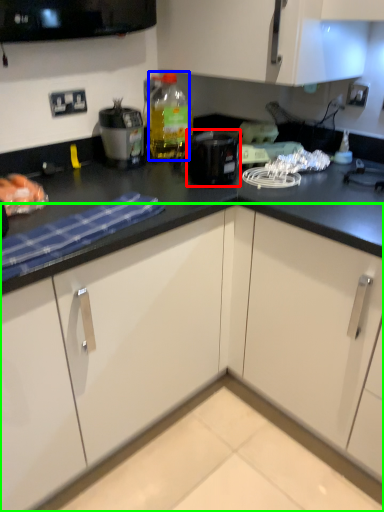
Question: Estimate the real-world distances between objects in this image. Which object is closer to kitchen appliance (highlighted by a red box), bottle (highlighted by a blue box) or cabinetry (highlighted by a green box)?

Choices:
 (A) bottle
 (B) cabinetry

Answer: (A)